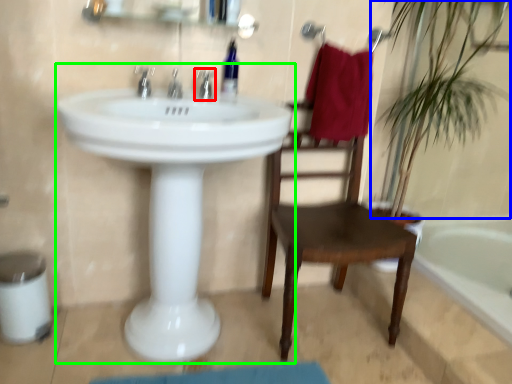
Question: Based on their relative distances, which object is farther from tap (highlighted by a red box)? Choose from vegetation (highlighted by a blue box) and sink (highlighted by a green box).

Choices:
 (A) vegetation
 (B) sink

Answer: (A)